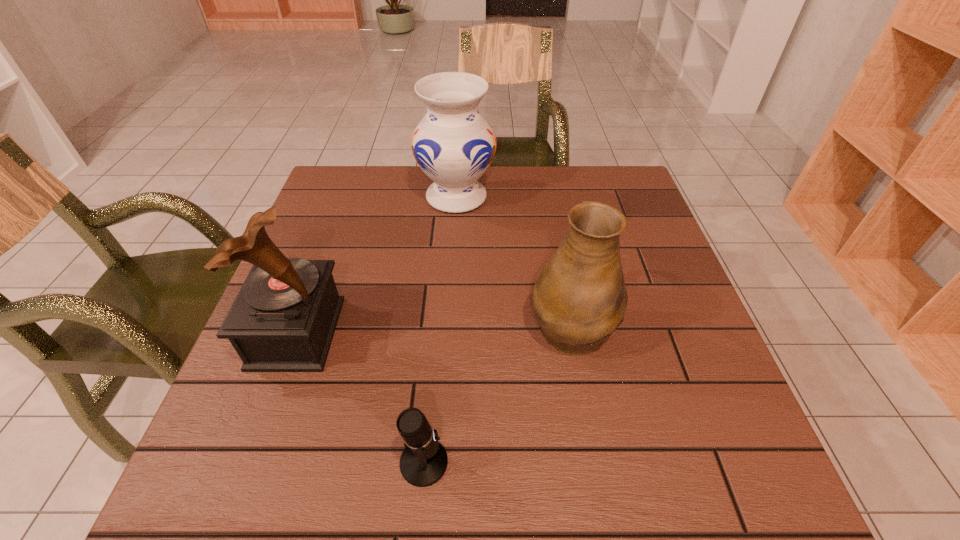
Locate which object is the second closest to the pitcher. Please provide its 2D coordinates. Your answer should be formatted as a tuple, i.e. [(x, y)], where the tuple contains the x and y coordinates of a point satisfying the conditions above.

[(453, 144)]

Image resolution: width=960 pixels, height=540 pixels. I want to click on blank space that satisfies the following two spatial constraints: 1. at the horn opening of the shortest object; 2. on the left side of the phonograph_record, so click(250, 462).

The height and width of the screenshot is (540, 960). Identify the location of free space that satisfies the following two spatial constraints: 1. on the back side of the nearest object; 2. on the left side of the farthest object. pos(447,197).